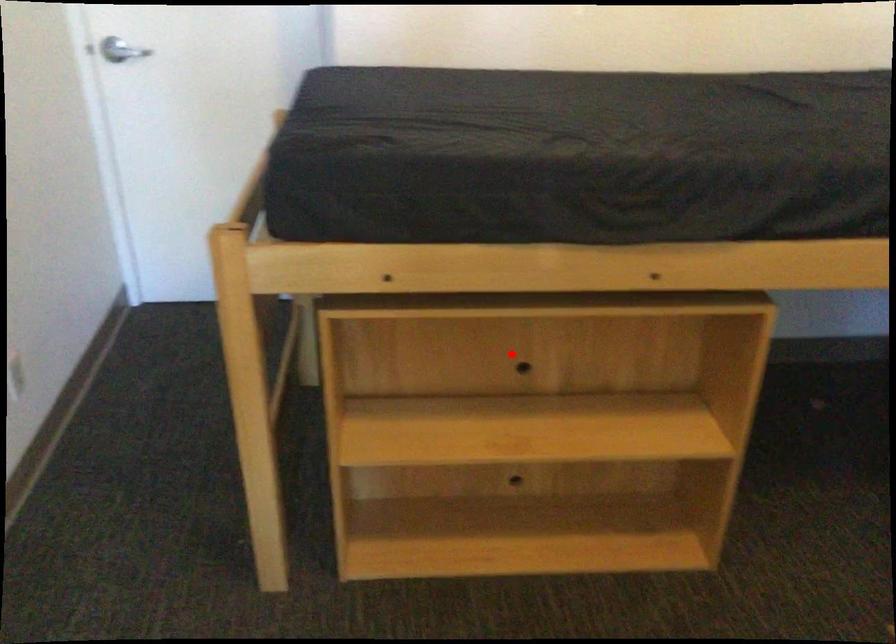
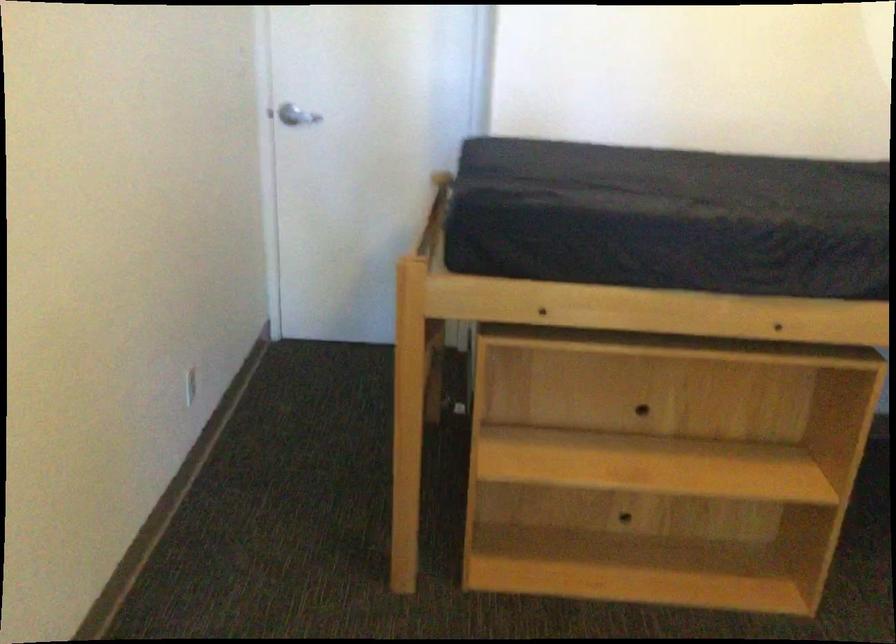
Where in the second image is the point corresponding to the highlighted location from the first image?

(633, 395)